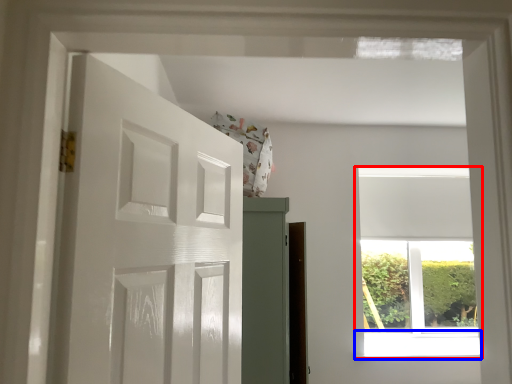
Question: Which object is further to the camera taking this photo, window (highlighted by a red box) or window sill (highlighted by a blue box)?

Choices:
 (A) window
 (B) window sill

Answer: (A)